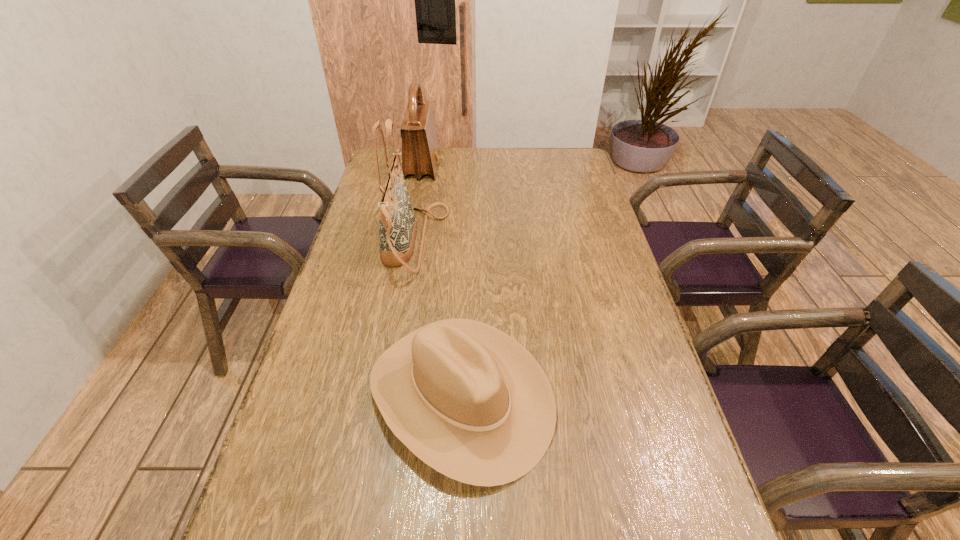
The width and height of the screenshot is (960, 540). In order to click on vacant area between the shoulder bag and the shortest object in this screenshot , I will do `click(442, 281)`.

At what (x,y) coordinates should I click in order to perform the action: click on empty location between the shortest object and the second farthest object. Please return your answer as a coordinate pair (x, y). The height and width of the screenshot is (540, 960). Looking at the image, I should click on (438, 318).

Find the location of a particular element. This screenshot has width=960, height=540. free area in between the tallest object and the farthest object is located at coordinates (419, 204).

Locate an element on the screen. Image resolution: width=960 pixels, height=540 pixels. vacant area that lies between the handbag and the shoulder bag is located at coordinates (419, 204).

You are a GUI agent. You are given a task and a screenshot of the screen. Output one action in this format:
    pyautogui.click(x=<x>, y=<y>)
    Task: Click on the object that is the second closest to the second tallest object
    
    Given the screenshot: What is the action you would take?
    pyautogui.click(x=471, y=402)

Image resolution: width=960 pixels, height=540 pixels. Find the location of `object that is the second nearest to the cowboy hat`. object that is the second nearest to the cowboy hat is located at coordinates (420, 151).

Find the location of `free location that satisfies the following two spatial constraints: 1. on the back side of the cowboy hat; 2. on the front-facing side of the handbag`. free location that satisfies the following two spatial constraints: 1. on the back side of the cowboy hat; 2. on the front-facing side of the handbag is located at coordinates (467, 241).

Locate an element on the screen. Image resolution: width=960 pixels, height=540 pixels. free space that satisfies the following two spatial constraints: 1. on the front flap of the nearest object; 2. on the left side of the farthest object is located at coordinates (379, 395).

This screenshot has height=540, width=960. In order to click on blank area in the image that satisfies the following two spatial constraints: 1. on the front flap of the shoulder bag; 2. on the right side of the cowboy hat in this screenshot , I will do `click(379, 395)`.

This screenshot has width=960, height=540. What are the coordinates of `free point that satisfies the following two spatial constraints: 1. on the front flap of the shortest object; 2. on the left side of the shoulder bag` in the screenshot? It's located at (379, 395).